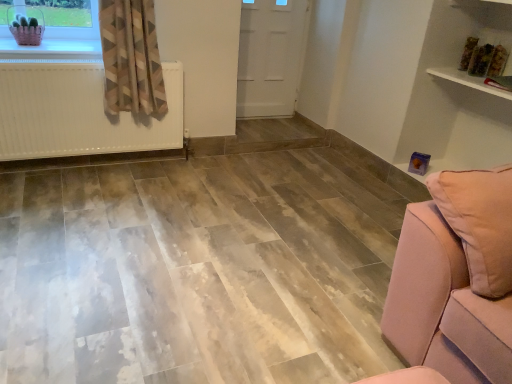
The width and height of the screenshot is (512, 384). In order to click on vacant area on top of white matte radiator at left (from a real-world perspective) in this screenshot , I will do `click(63, 56)`.